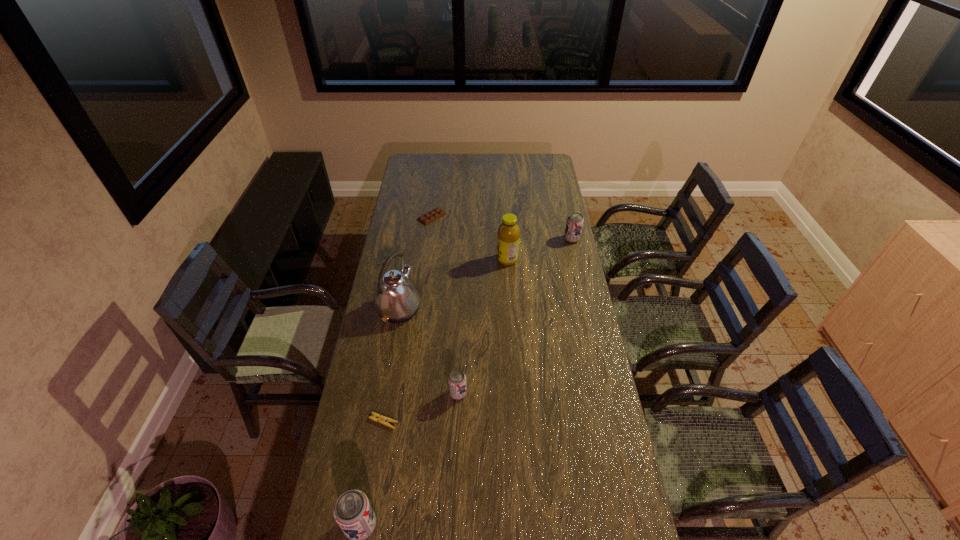
You are a GUI agent. You are given a task and a screenshot of the screen. Output one action in this format:
    pyautogui.click(x=<x>, y=<y>)
    Task: Click on the second nearest beer can
    This screenshot has height=540, width=960.
    Given the screenshot: What is the action you would take?
    pyautogui.click(x=457, y=379)

Where is `the shortest beer can`? the shortest beer can is located at coordinates (457, 379).

I want to click on the second shortest beer can, so click(574, 224).

Locate an element on the screen. This screenshot has width=960, height=540. the rightmost object is located at coordinates (574, 224).

Identify the location of the farthest object. (433, 215).

Locate an element on the screen. Image resolution: width=960 pixels, height=540 pixels. fruit juice is located at coordinates (508, 233).

Locate an element on the screen. This screenshot has height=540, width=960. the third farthest object is located at coordinates (508, 233).

Identify the location of clothespin. The width and height of the screenshot is (960, 540). (381, 419).

The image size is (960, 540). Find the location of `the tallest object`. the tallest object is located at coordinates (397, 300).

I want to click on the fourth nearest object, so click(397, 300).